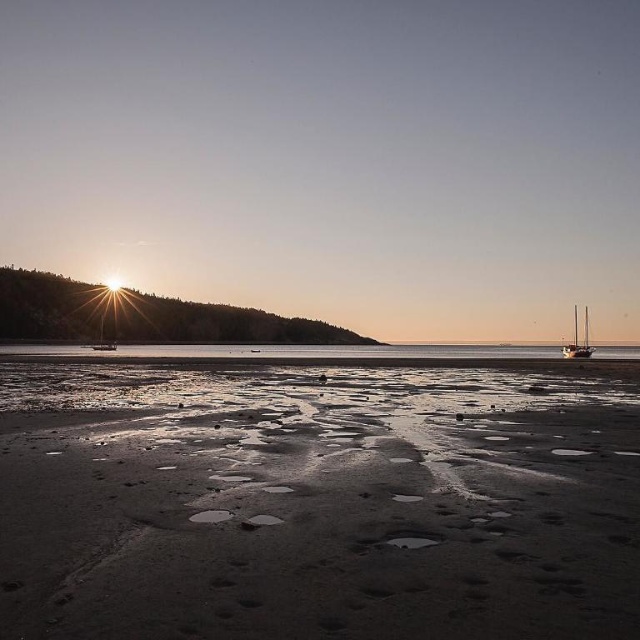
Looking at this image, you are standing on the beach and want to walk from the damp sand at center to the wooden sailboat at right. Which direction should you head?

The damp sand at center is in front of the wooden sailboat at right, so you should walk towards the wooden sailboat at right from the damp sand at center. Since the damp sand is in front, you would move backward or towards the direction of the wooden sailboat at right to reach it.

You are a photographer setting up equipment on the beach. You need to place your tripod on the damp sand at center and position a wooden sailboat at right such that the sailboat is wider than the sand area. Is this possible based on the scene?

The damp sand at center has a lesser width compared to wooden sailboat at right, so yes, the wooden sailboat at right is wider than the damp sand at center. This arrangement is possible.